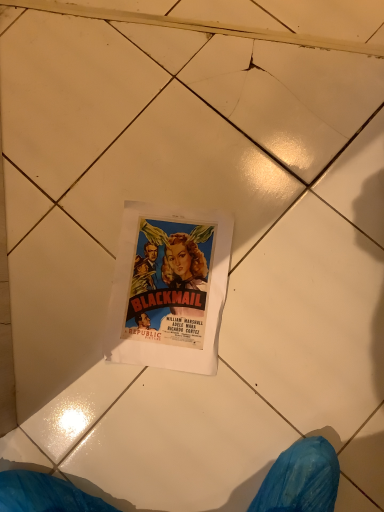
At what (x,y) coordinates should I click in order to perform the action: click on free spot above matte paper poster at center (from a real-world perspective). Please return your answer as a coordinate pair (x, y). The width and height of the screenshot is (384, 512). Looking at the image, I should click on (172, 284).